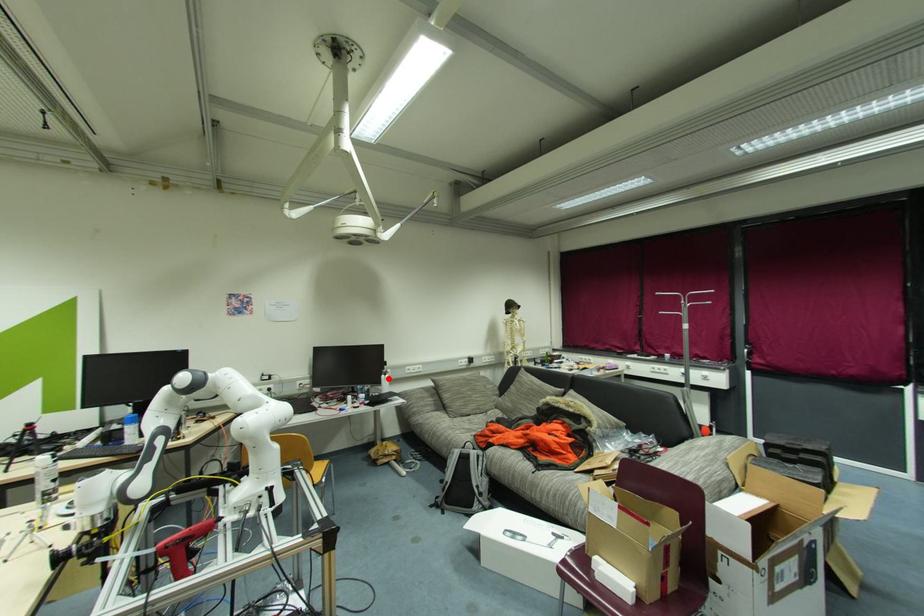
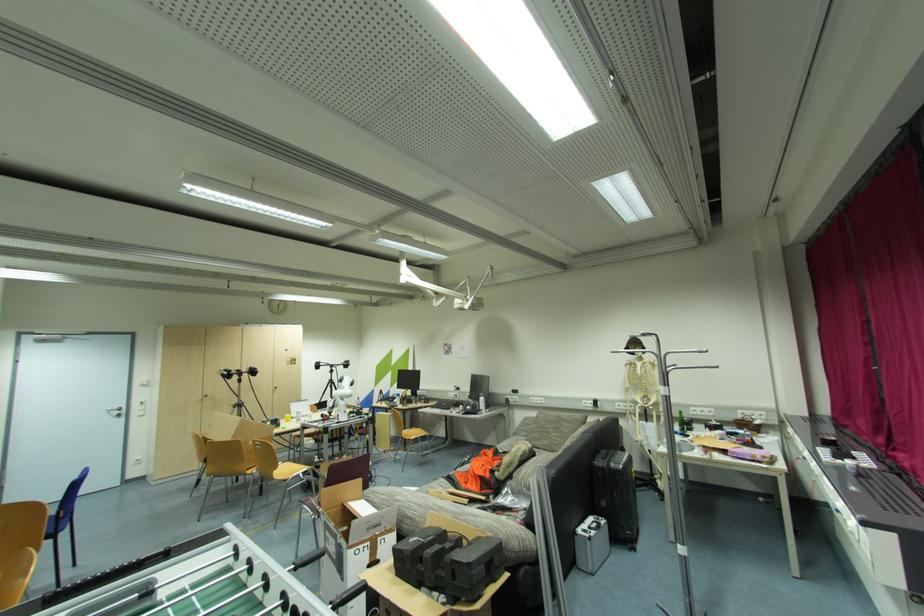
Where in the second image is the point corresponding to the highlighted location from the first image?

(484, 400)